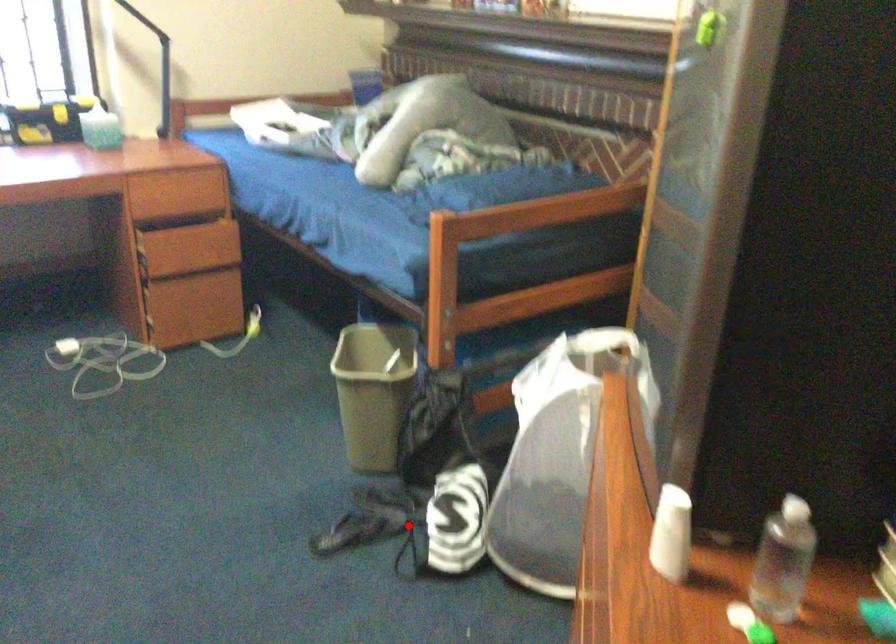
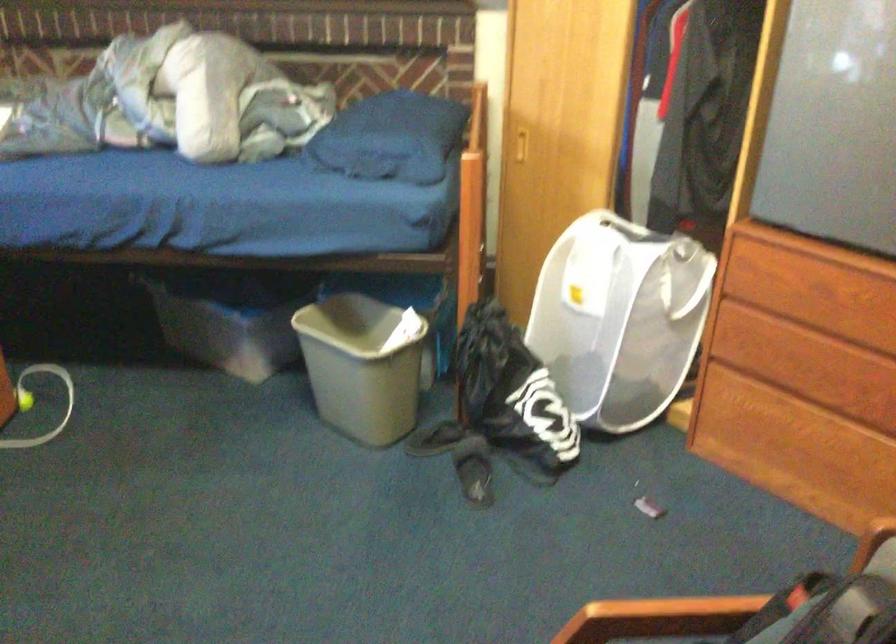
Where in the second image is the point corresponding to the highlighted location from the first image?

(474, 469)